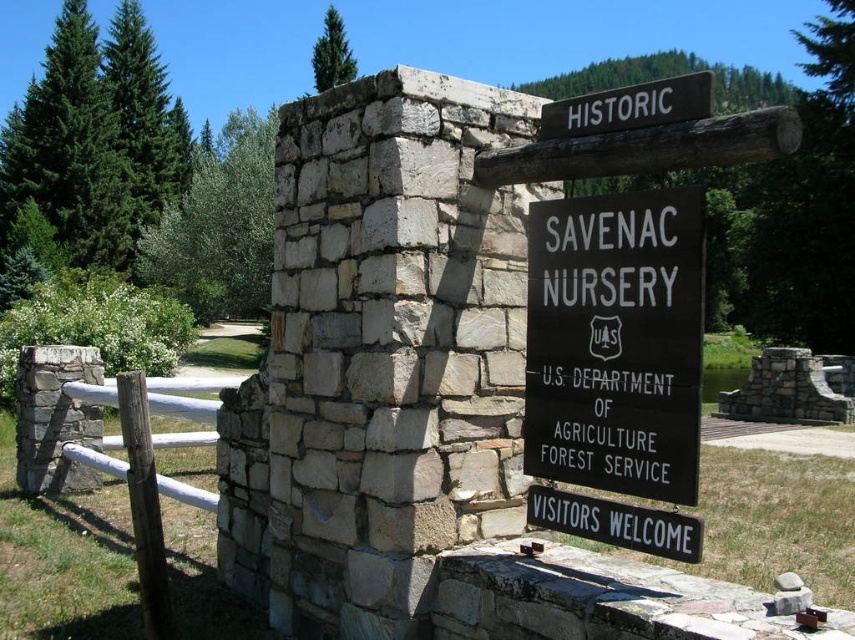
You are a visitor approaching the entrance of the historic nursery site. You notice two signs on the archway. The first is a black wood sign at center, and the second is a white wood sign at upper center. Which sign is taller?

The black wood sign at center is taller than the white wood sign at upper center.

You are a maintenance worker who needs to replace a loose board on the white wooden fence at left. You have a ladder that is 4 meters long. The white wood sign at upper center is in the way. Can you safely reach the fence without moving the sign?

The distance between the white wooden fence at left and the white wood sign at upper center is 4.80 meters. Since your ladder is 4 meters long, it is shorter than the distance, so you cannot safely reach the fence without moving the sign.